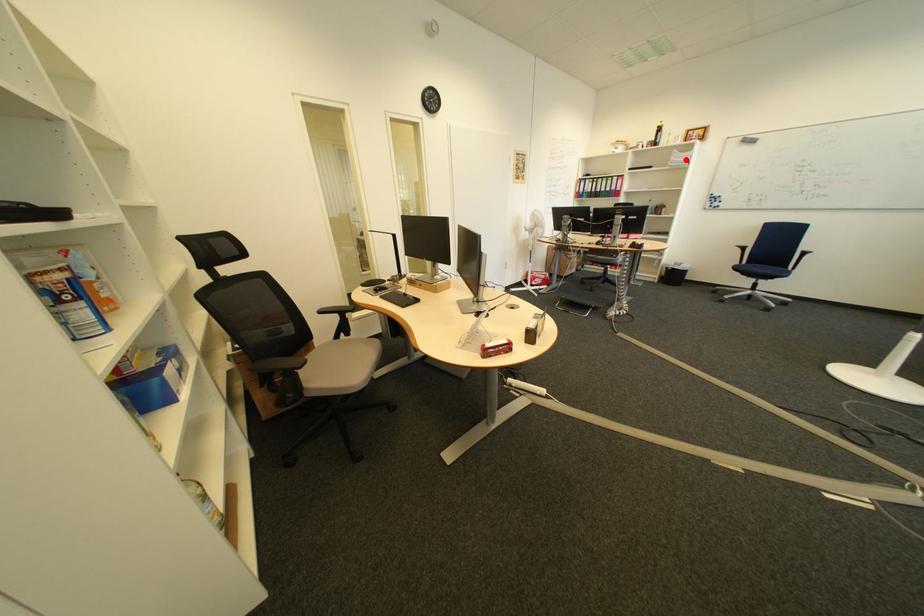
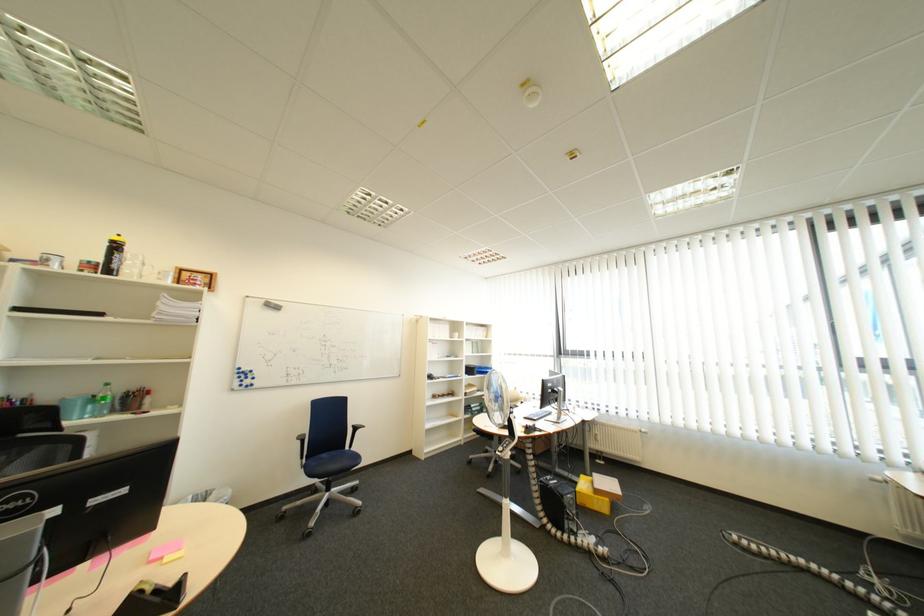
In the second image, find the point that corresponds to the highlighted location in the first image.

(175, 309)